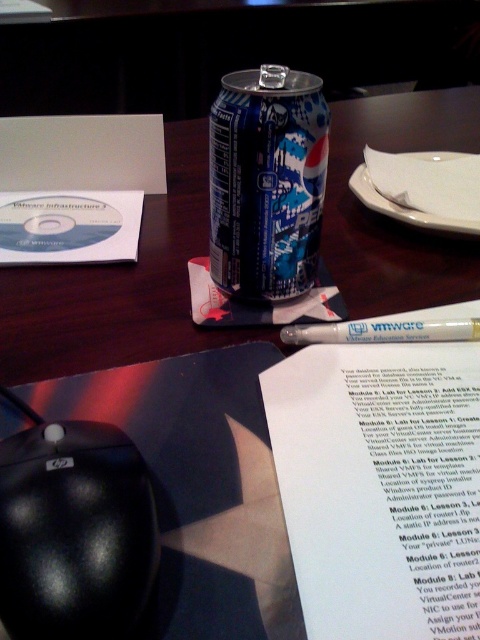
You are organizing items on a table and need to place a new item between the blue metallic pepsi can at center and the white matte pen at center. Based on their current positions, where should you place the new item?

The new item should be placed between the blue metallic pepsi can at center and the white matte pen at center, as the blue metallic pepsi can at center is positioned on the left side of white matte pen at center.

Where is the black matte mouse at lower left located in the image?

The black matte mouse at lower left is located at point (74,532) in the image.